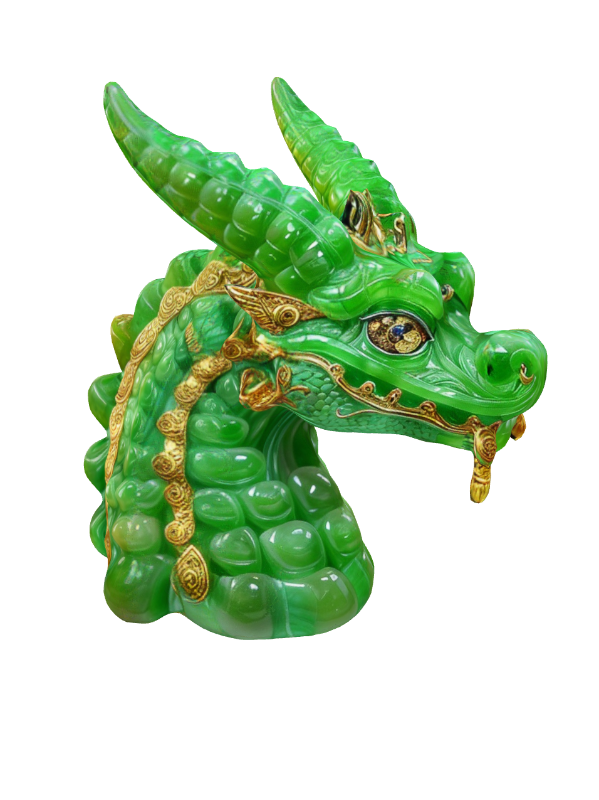
At what (x,y) coordinates should I click in order to perform the action: click on scales. Please return your answer as a coordinate pair (x, y). This screenshot has width=599, height=800. Looking at the image, I should click on (142, 534).